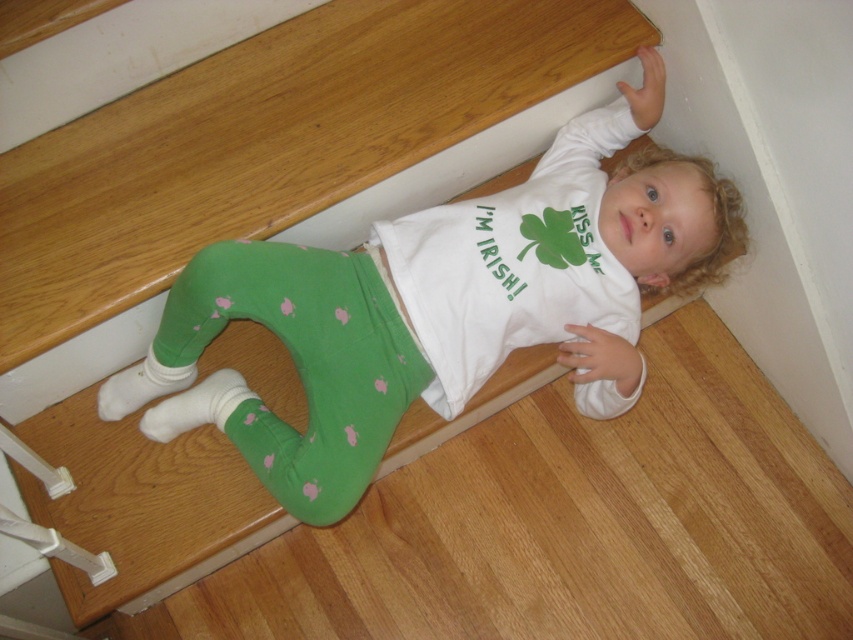
You are a photographer setting up a shoot in this scene. You need to place a small prop exactly at the coordinates provided for the green cotton leggings at lower center. Where should you position the prop relative to the child?

A: The green cotton leggings at lower center are located at point coordinates (440, 305). Since the child is lying on the staircase, the prop should be placed directly on the step where the child is positioned, near the lower center area of the image.